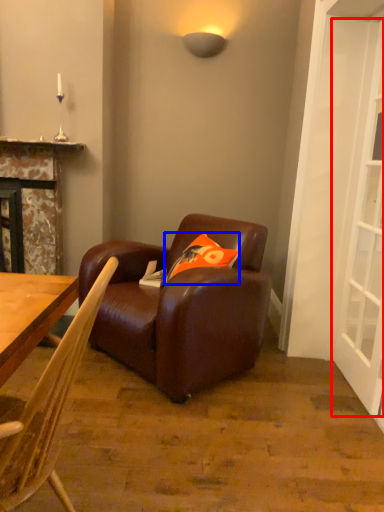
Question: Among these objects, which one is farthest to the camera, screen door (highlighted by a red box) or pillow (highlighted by a blue box)?

Choices:
 (A) screen door
 (B) pillow

Answer: (B)